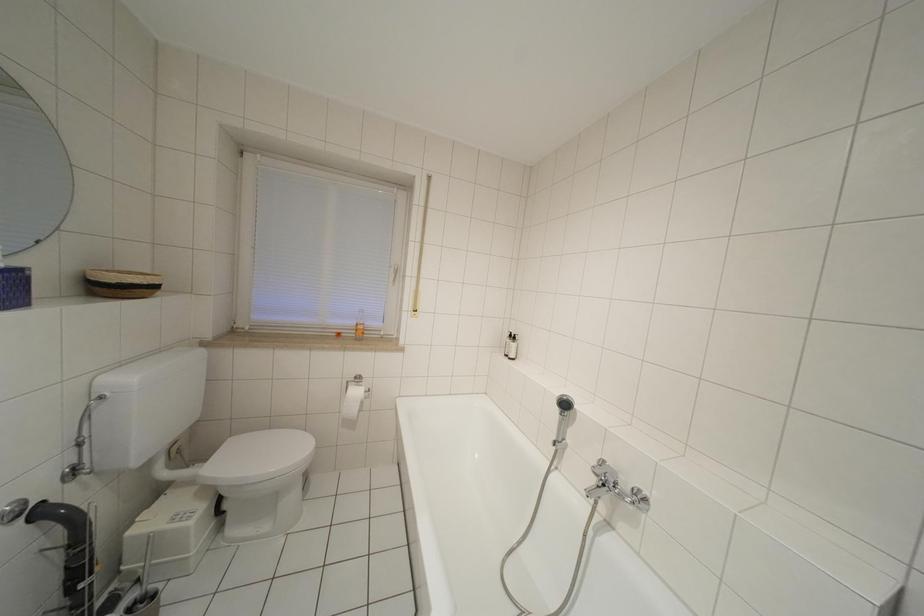
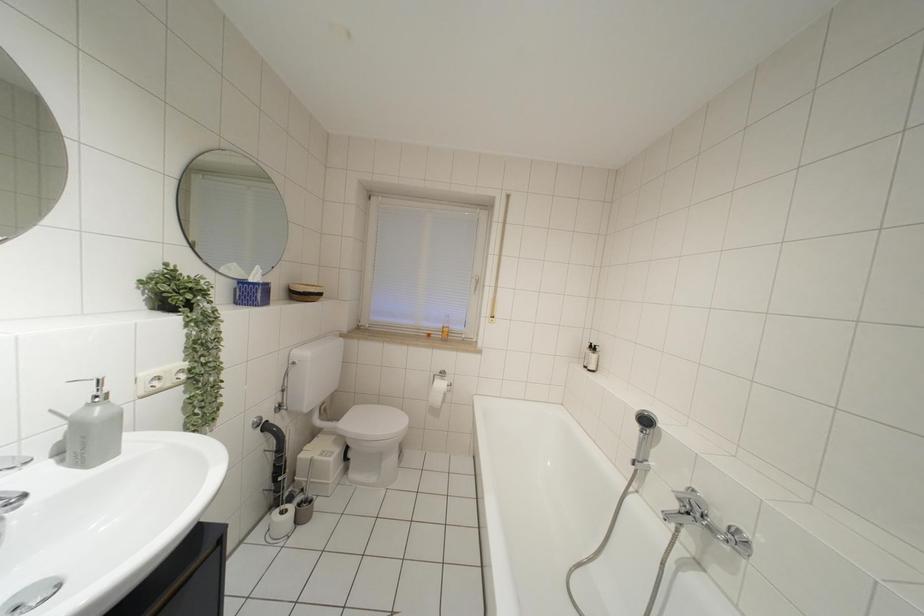
Question: The camera is either moving clockwise (left) or counter-clockwise (right) around the object. The first image is from the beginning of the video and the second image is from the end. Is the camera moving left or right when shooting the video?

Choices:
 (A) Left
 (B) Right

Answer: (B)